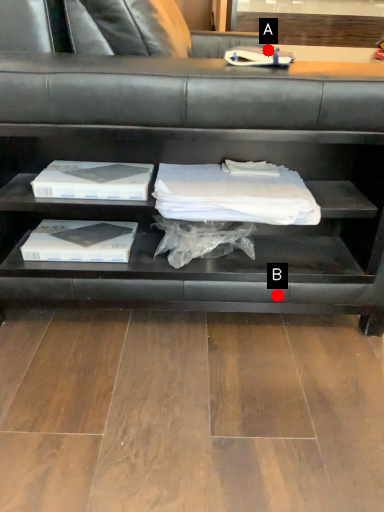
Question: Two points are circled on the image, labeled by A and B beside each circle. Which point appears closest to the camera in this image?

Choices:
 (A) A is closer
 (B) B is closer

Answer: (B)